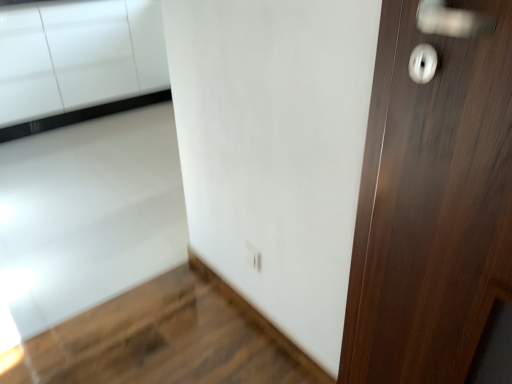
Question: Does dark wood door at right contain white glossy cabinetry at lower left?

Choices:
 (A) no
 (B) yes

Answer: (A)

Question: Does dark wood door at right appear on the left side of white glossy cabinetry at lower left?

Choices:
 (A) yes
 (B) no

Answer: (B)

Question: Is dark wood door at right aimed at white glossy cabinetry at lower left?

Choices:
 (A) no
 (B) yes

Answer: (A)

Question: Is dark wood door at right at the right side of white glossy cabinetry at lower left?

Choices:
 (A) no
 (B) yes

Answer: (B)

Question: Would you say dark wood door at right is a long distance from white glossy cabinetry at lower left?

Choices:
 (A) no
 (B) yes

Answer: (B)

Question: Does dark wood door at right have a greater width compared to white glossy cabinetry at lower left?

Choices:
 (A) no
 (B) yes

Answer: (A)

Question: From a real-world perspective, is white glossy electric outlet at lower center on top of white glossy cabinetry at lower left?

Choices:
 (A) no
 (B) yes

Answer: (A)

Question: Does white glossy electric outlet at lower center come in front of white glossy cabinetry at lower left?

Choices:
 (A) yes
 (B) no

Answer: (A)

Question: Is white glossy electric outlet at lower center to the right of white glossy cabinetry at lower left from the viewer's perspective?

Choices:
 (A) no
 (B) yes

Answer: (B)

Question: Considering the relative sizes of white glossy electric outlet at lower center and white glossy cabinetry at lower left in the image provided, is white glossy electric outlet at lower center wider than white glossy cabinetry at lower left?

Choices:
 (A) yes
 (B) no

Answer: (B)

Question: Does white glossy electric outlet at lower center appear on the left side of white glossy cabinetry at lower left?

Choices:
 (A) yes
 (B) no

Answer: (B)

Question: Is white glossy electric outlet at lower center facing towards white glossy cabinetry at lower left?

Choices:
 (A) no
 (B) yes

Answer: (A)

Question: Is white glossy electric outlet at lower center positioned with its back to dark wood door at right?

Choices:
 (A) yes
 (B) no

Answer: (B)